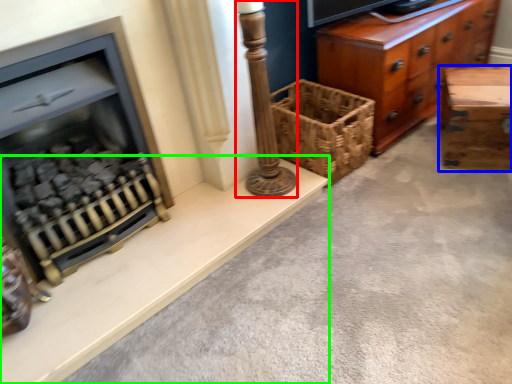
Question: Which is nearer to the pillar (highlighted by a red box)? table (highlighted by a blue box) or ledge (highlighted by a green box).

Choices:
 (A) table
 (B) ledge

Answer: (B)